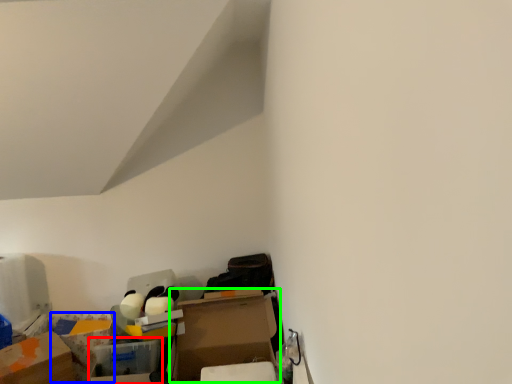
Question: Which object is the closest to the storage box (highlighted by a red box)? Choose among these: storage box (highlighted by a blue box) or cardboard box (highlighted by a green box).

Choices:
 (A) storage box
 (B) cardboard box

Answer: (B)